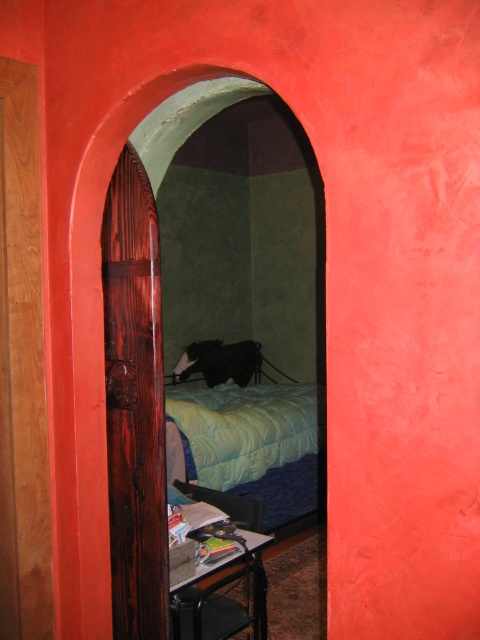
You are a delivery person carrying a package that requires a clear path of at least 8 feet to reach the blue quilted bed at center. Can you navigate through the wooden door at center to the bed without needing to adjust your path?

The distance between the wooden door at center and the blue quilted bed at center is 8.11 feet, which is more than the required 8 feet. Therefore, you can navigate through the wooden door at center to the bed without needing to adjust your path.

You are standing in the hallway and see the wooden door at center and the blue quilted bed at center. Which object is closer to the left side of the hallway?

The wooden door at center is to the left of the blue quilted bed at center, so the wooden door at center is closer to the left side of the hallway.